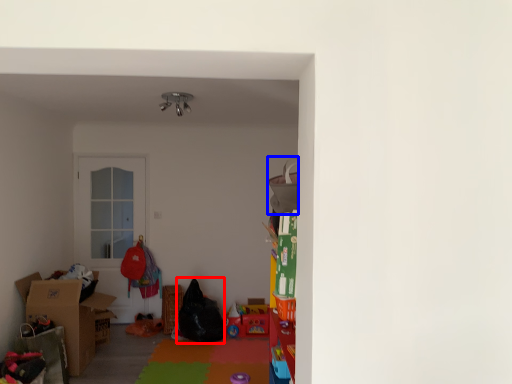
Question: Which object is further to the camera taking this photo, bean bag chair (highlighted by a red box) or bean bag chair (highlighted by a blue box)?

Choices:
 (A) bean bag chair
 (B) bean bag chair

Answer: (A)